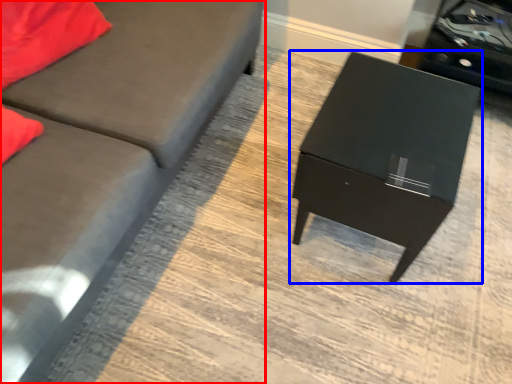
Question: Which point is closer to the camera, studio couch (highlighted by a red box) or table (highlighted by a blue box)?

Choices:
 (A) studio couch
 (B) table

Answer: (A)